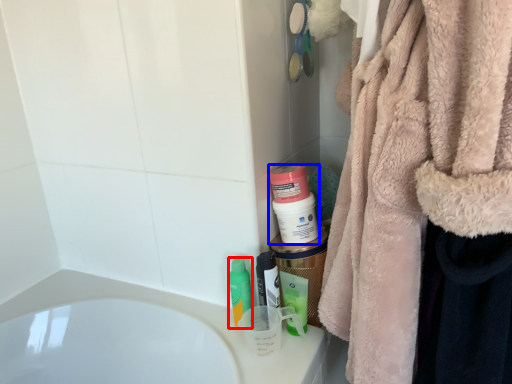
Question: Which object is closer to the camera taking this photo, mouthwash (highlighted by a red box) or mouthwash (highlighted by a blue box)?

Choices:
 (A) mouthwash
 (B) mouthwash

Answer: (B)